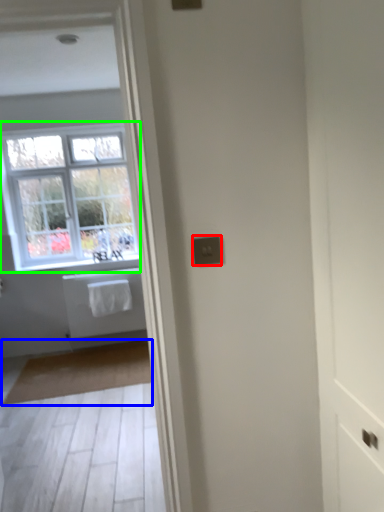
Question: Which object is the closest to the electric outlet (highlighted by a red box)? Choose among these: mat (highlighted by a blue box) or window (highlighted by a green box).

Choices:
 (A) mat
 (B) window

Answer: (A)